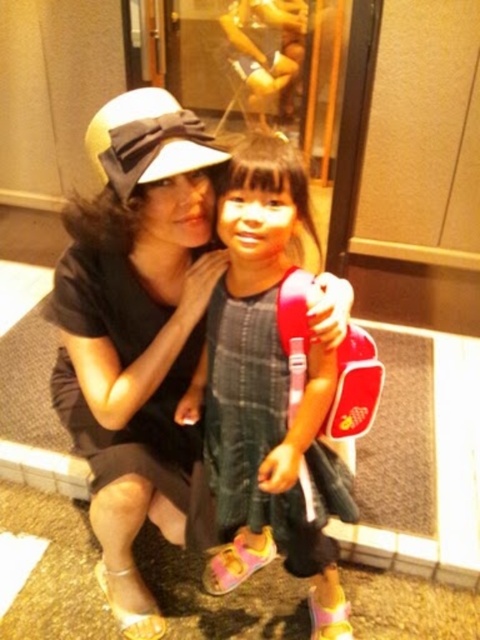
Between matte black hat at upper left and plaid fabric dress at center, which one appears on the right side from the viewer's perspective?

From the viewer's perspective, plaid fabric dress at center appears more on the right side.

Who is more forward, (124, 138) or (283, 157)?

Point (124, 138) is in front.

Describe the element at coordinates (135, 330) in the screenshot. This screenshot has width=480, height=640. I see `matte black hat at upper left` at that location.

The width and height of the screenshot is (480, 640). Find the location of `matte black hat at upper left`. matte black hat at upper left is located at coordinates (135, 330).